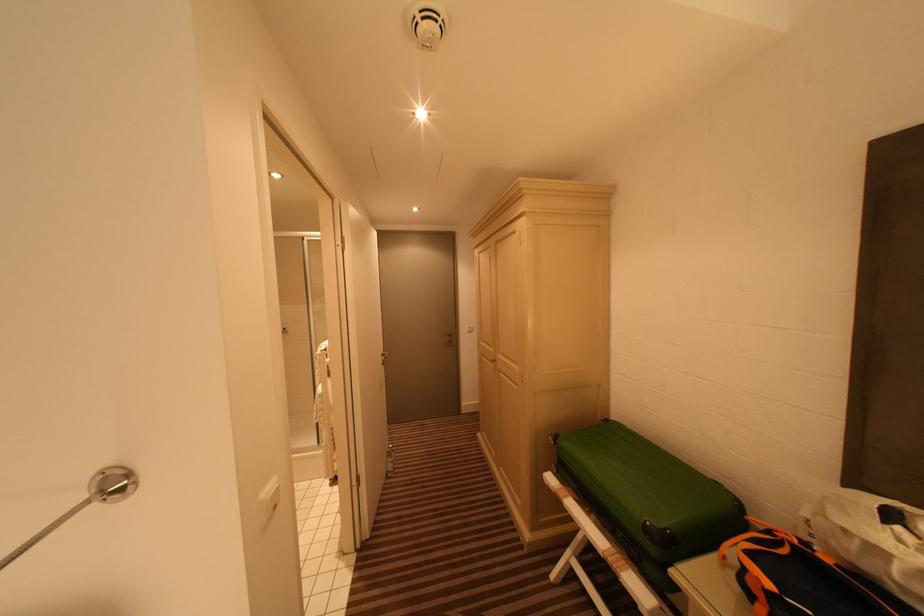
You are a GUI agent. You are given a task and a screenshot of the screen. Output one action in this format:
    pyautogui.click(x=<x>, y=<y>)
    Task: Click on the shower door handle
    The width and height of the screenshot is (924, 616).
    Given the screenshot: What is the action you would take?
    pyautogui.click(x=86, y=503)